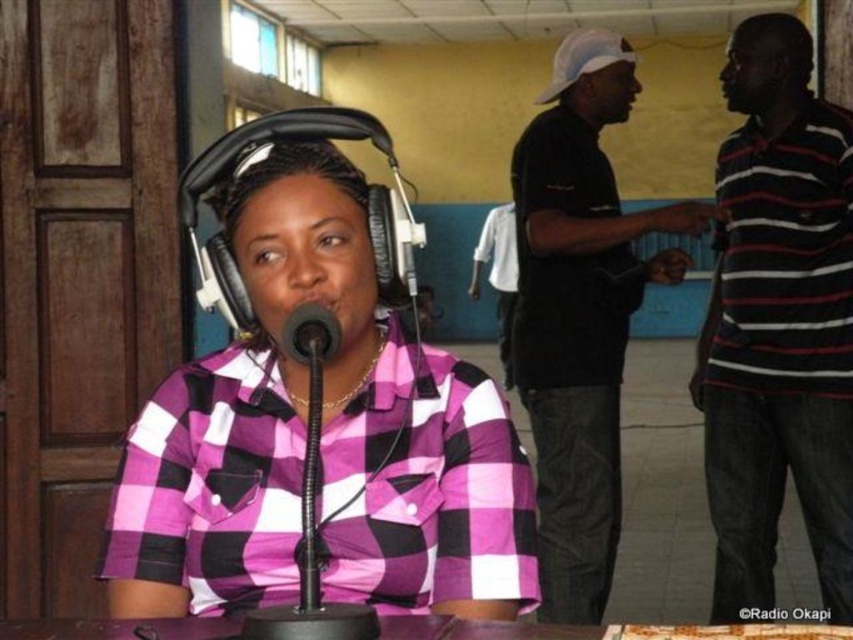
Question: Estimate the real-world distances between objects in this image. Which object is closer to the pink checkered shirt at center?

Choices:
 (A) black matte microphone at center
 (B) striped cotton shirt at right
 (C) black matte shirt at upper right

Answer: (A)

Question: Is pink checkered shirt at center positioned in front of striped cotton shirt at right?

Choices:
 (A) no
 (B) yes

Answer: (B)

Question: Which point is closer to the camera taking this photo?

Choices:
 (A) (317, 346)
 (B) (744, 35)
 (C) (590, 285)

Answer: (A)

Question: Observing the image, what is the correct spatial positioning of pink checkered shirt at center in reference to striped cotton shirt at right?

Choices:
 (A) below
 (B) above

Answer: (A)

Question: Which point appears closest to the camera in this image?

Choices:
 (A) (589, 349)
 (B) (282, 337)
 (C) (263, 196)

Answer: (B)

Question: Is pink checkered shirt at center bigger than striped cotton shirt at right?

Choices:
 (A) no
 (B) yes

Answer: (A)